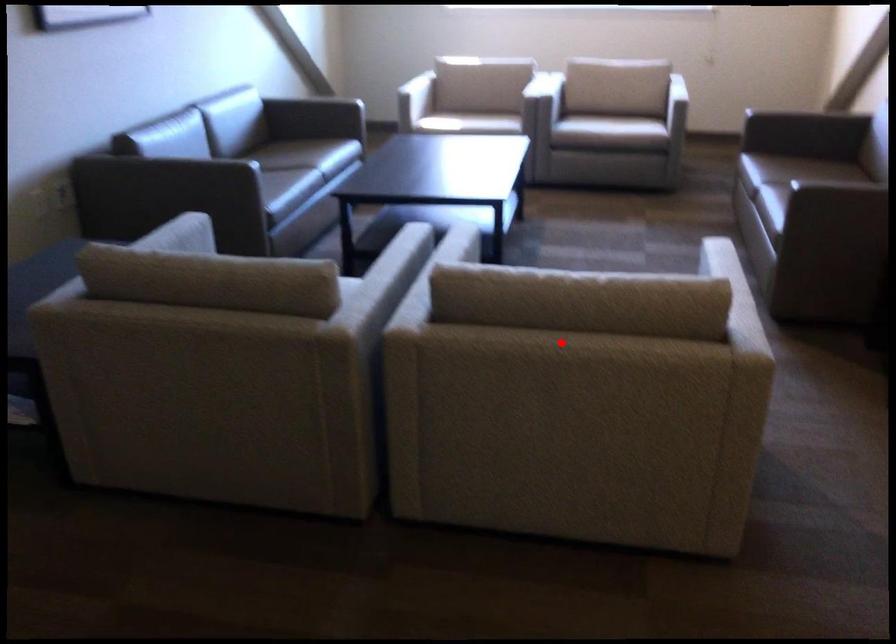
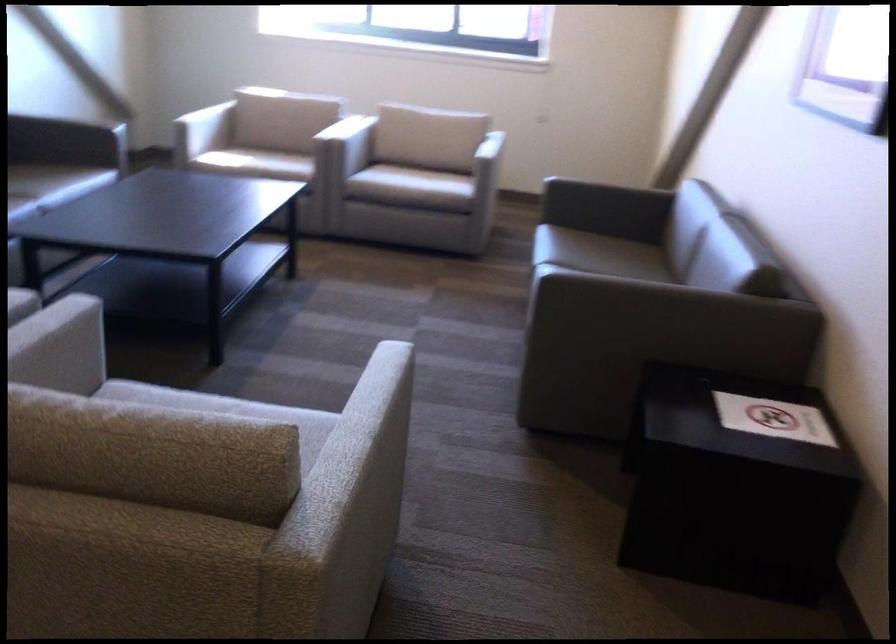
In the second image, find the point that corresponds to the highlighted location in the first image.

(39, 524)